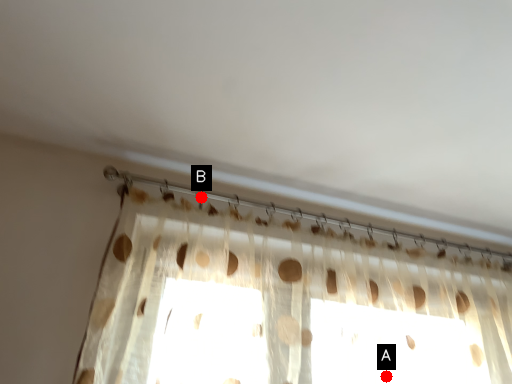
Question: Two points are circled on the image, labeled by A and B beside each circle. Among these points, which one is nearest to the camera?

Choices:
 (A) A is closer
 (B) B is closer

Answer: (A)